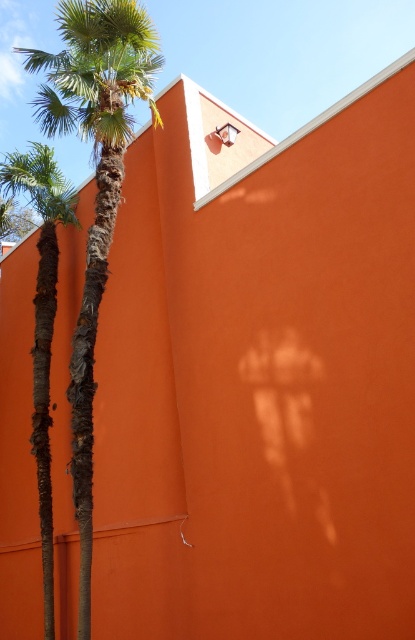
You are a painter standing in front of the orange wall. You want to paint both the green leafy palm tree at left and the green textured palm tree at left. Which tree should you look up more to paint?

The green leafy palm tree at left is much taller than the green textured palm tree at left, so you should look up more to paint the green leafy palm tree at left.

You are a painter standing in front of the orange wall and want to paint both the green leafy palm tree at left and the green textured palm tree at left. Which tree should you focus on first if you want to paint the larger one?

The green leafy palm tree at left is bigger than the green textured palm tree at left, so you should focus on painting the green leafy palm tree at left first.